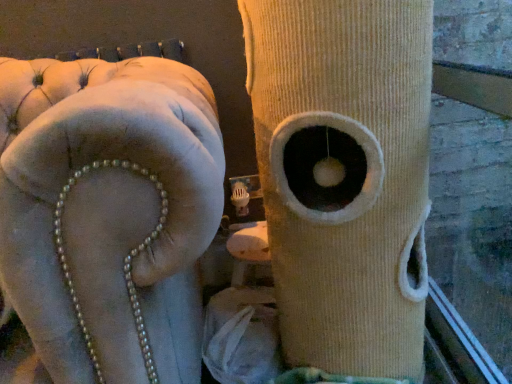
Question: Considering the positions of beige corduroy cat tree at center and velvet beige sofa at upper left in the image, is beige corduroy cat tree at center wider or thinner than velvet beige sofa at upper left?

Choices:
 (A) wide
 (B) thin

Answer: (B)

Question: Is point (395, 46) positioned closer to the camera than point (109, 319)?

Choices:
 (A) closer
 (B) farther

Answer: (B)

Question: From the image's perspective, is beige corduroy cat tree at center above or below velvet beige sofa at upper left?

Choices:
 (A) below
 (B) above

Answer: (B)

Question: Considering their positions, is velvet beige sofa at upper left located in front of or behind beige corduroy cat tree at center?

Choices:
 (A) behind
 (B) front

Answer: (B)

Question: From a real-world perspective, is velvet beige sofa at upper left positioned above or below beige corduroy cat tree at center?

Choices:
 (A) above
 (B) below

Answer: (B)

Question: In terms of size, does velvet beige sofa at upper left appear bigger or smaller than beige corduroy cat tree at center?

Choices:
 (A) big
 (B) small

Answer: (A)

Question: Considering the positions of point (10, 240) and point (325, 18), is point (10, 240) closer or farther from the camera than point (325, 18)?

Choices:
 (A) closer
 (B) farther

Answer: (A)